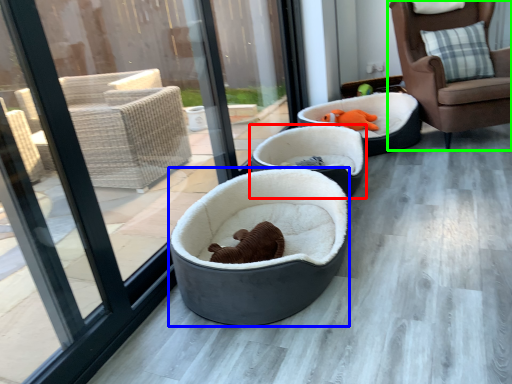
Question: Considering the real-world distances, which object is closest to dog bed (highlighted by a red box)? dog bed (highlighted by a blue box) or chair (highlighted by a green box).

Choices:
 (A) dog bed
 (B) chair

Answer: (A)